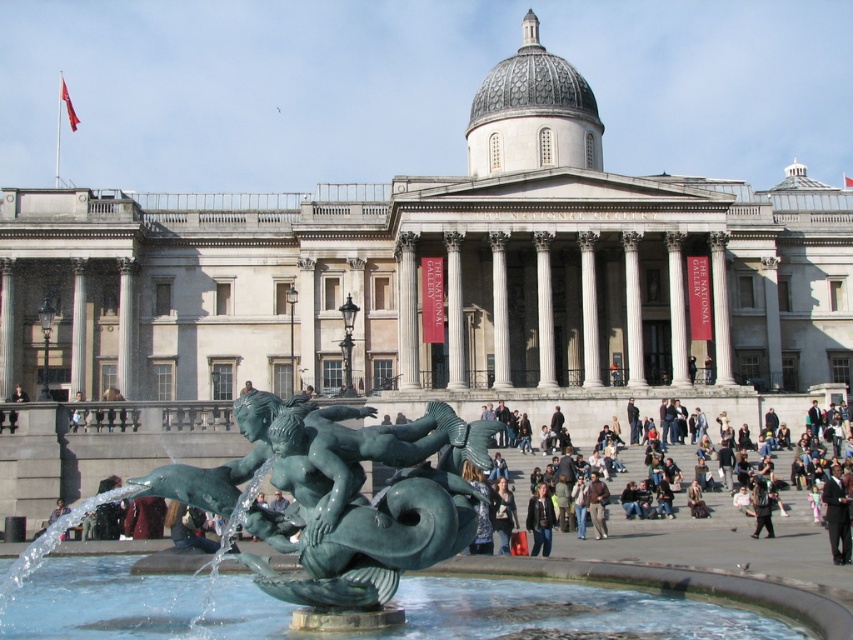
Is point (589, 129) closer to camera compared to point (601, 534)?

No, it is behind (601, 534).

Is gray stone dome at center shorter than brown leather jacket at center?

In fact, gray stone dome at center may be taller than brown leather jacket at center.

This screenshot has height=640, width=853. What are the coordinates of `gray stone dome at center` in the screenshot? It's located at (532, 113).

At what (x,y) coordinates should I click in order to perform the action: click on gray stone dome at center. Please return your answer as a coordinate pair (x, y). Looking at the image, I should click on (532, 113).

Between leather jacket at center and light brown leather jacket at lower center, which one appears on the right side from the viewer's perspective?

Positioned to the right is leather jacket at center.

Who is more forward, (537, 544) or (51, 509)?

Point (537, 544)

Identify the location of leather jacket at center. The image size is (853, 640). (540, 520).

Where is `leather jacket at center`? This screenshot has height=640, width=853. leather jacket at center is located at coordinates (540, 520).

Which is above, gray stone dome at center or denim jacket at lower center?

gray stone dome at center is above.

Does gray stone dome at center have a greater width compared to denim jacket at lower center?

Correct, the width of gray stone dome at center exceeds that of denim jacket at lower center.

Is point (567, 148) behind point (505, 502)?

Yes, it is.

You are a GUI agent. You are given a task and a screenshot of the screen. Output one action in this format:
    pyautogui.click(x=<x>, y=<y>)
    Task: Click on the gray stone dome at center
    
    Given the screenshot: What is the action you would take?
    pyautogui.click(x=532, y=113)